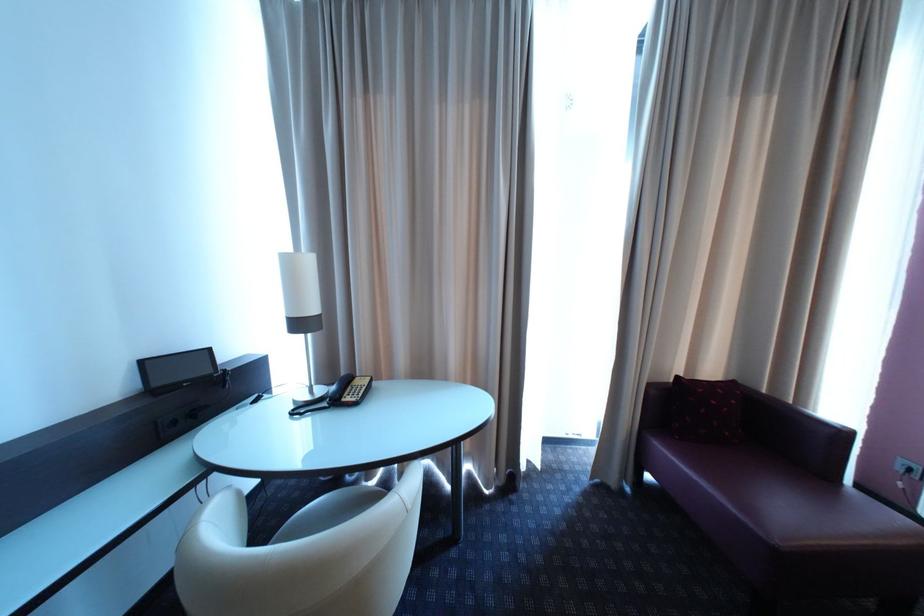
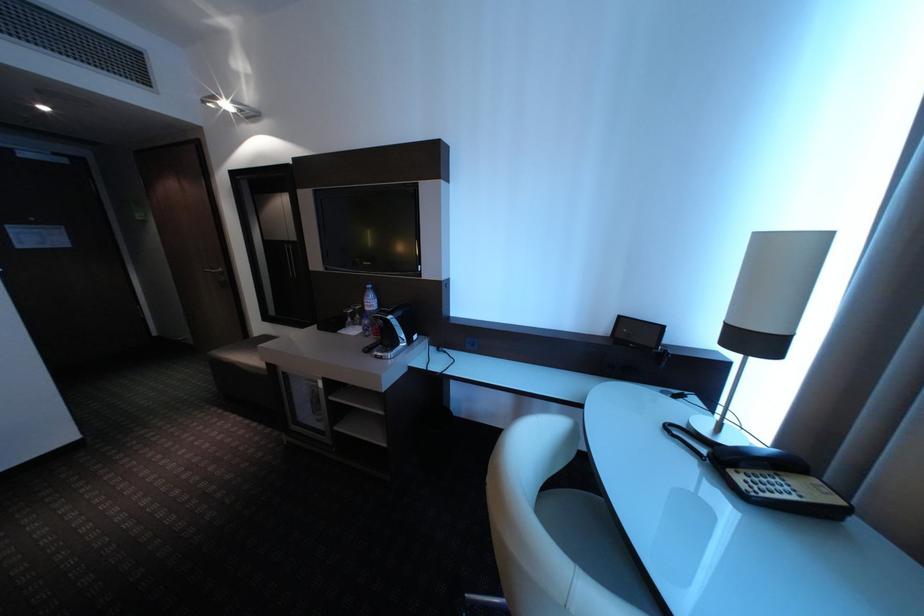
Based on the continuous images, in which direction is the camera rotating?

The rotation direction of the camera is left-down.